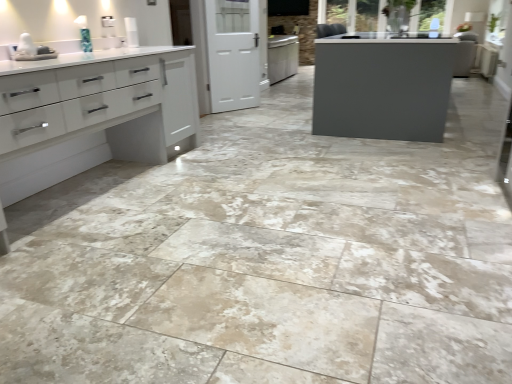
Where is `free space below white matte screen door at center (from a real-world perspective)`? The height and width of the screenshot is (384, 512). free space below white matte screen door at center (from a real-world perspective) is located at coordinates (234, 110).